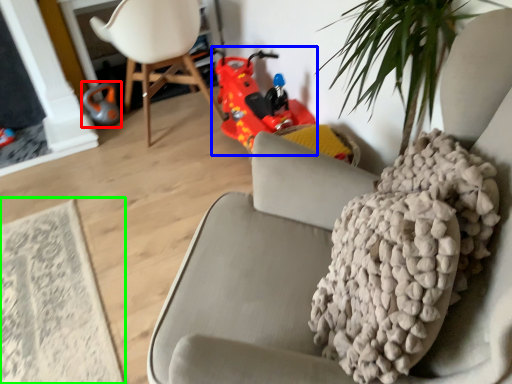
Question: Which is nearer to the toy (highlighted by a red box)? toy car (highlighted by a blue box) or mat (highlighted by a green box).

Choices:
 (A) toy car
 (B) mat

Answer: (A)